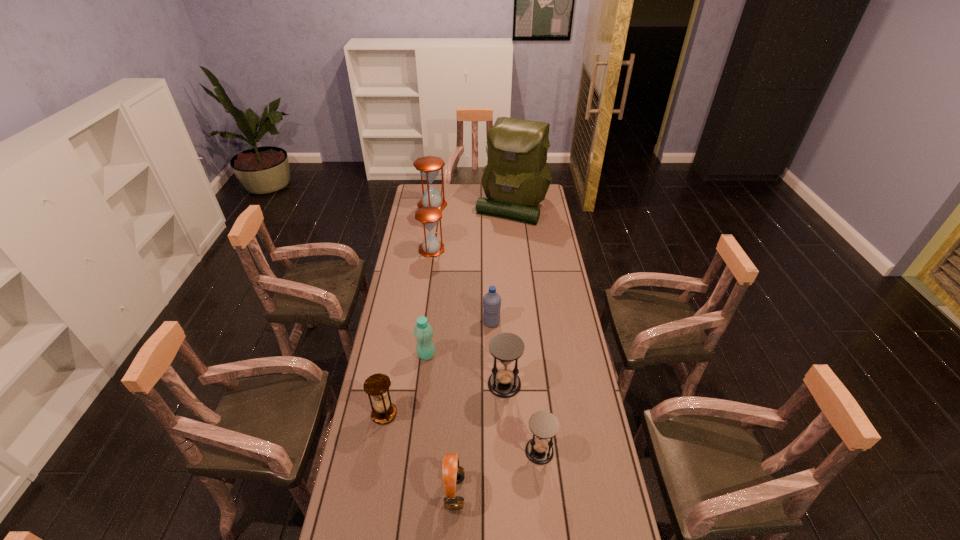
The width and height of the screenshot is (960, 540). Find the location of `backpack`. backpack is located at coordinates (516, 178).

The height and width of the screenshot is (540, 960). What are the coordinates of `the tallest object` in the screenshot? It's located at (516, 178).

This screenshot has height=540, width=960. I want to click on the tallest hourglass, so click(x=429, y=166).

Find the location of a particular element. the biggest brown hourglass is located at coordinates (429, 166).

You are a GUI agent. You are given a task and a screenshot of the screen. Output one action in this format:
    pyautogui.click(x=<x>, y=<y>)
    Task: Click on the second biggest brown hourglass
    The height and width of the screenshot is (540, 960).
    Given the screenshot: What is the action you would take?
    [428, 216]

Find the location of a particular element. The height and width of the screenshot is (540, 960). the third farthest object is located at coordinates (428, 216).

At what (x,y) coordinates should I click in order to perform the action: click on the third farthest hourglass. Please return your answer as a coordinate pair (x, y). Looking at the image, I should click on (506, 347).

This screenshot has height=540, width=960. Find the location of `the fourth nearest object`. the fourth nearest object is located at coordinates (506, 347).

I want to click on the fourth farthest object, so click(x=491, y=301).

Where is `blue water bottle`? blue water bottle is located at coordinates (491, 301).